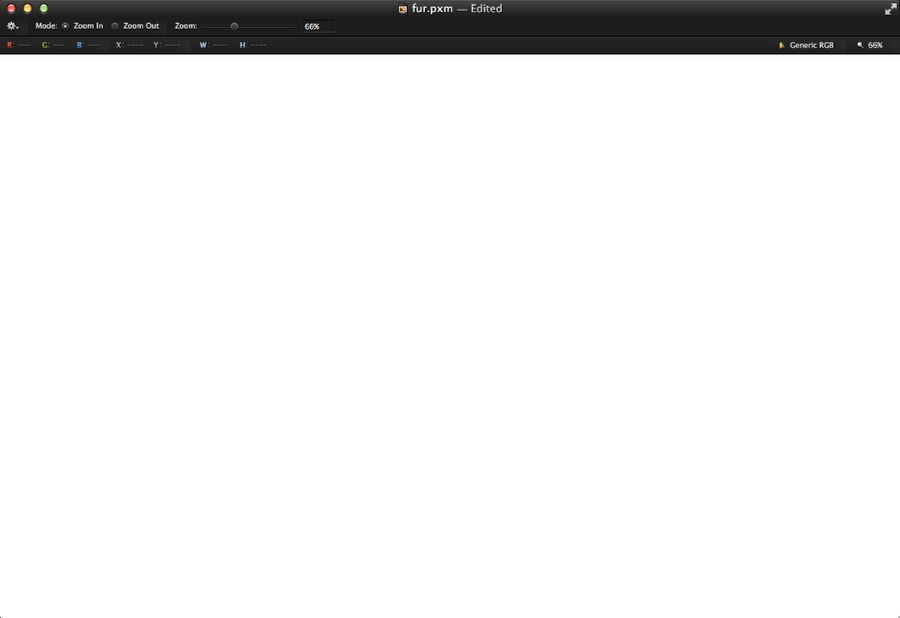
Locate an element on the screen. This screenshot has width=900, height=618. red circular exit button is located at coordinates (9, 7).